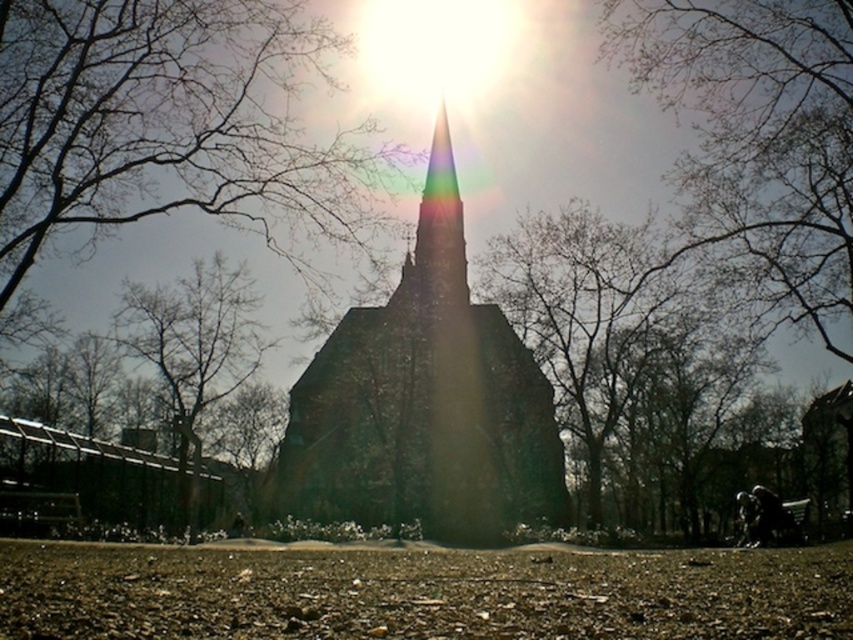
Is bare branches at center to the right of bare branches at upper center from the viewer's perspective?

No, bare branches at center is not to the right of bare branches at upper center.

Is bare branches at center thinner than bare branches at upper center?

No, bare branches at center is not thinner than bare branches at upper center.

Is point (166, 42) in front of point (834, 45)?

No, (166, 42) is further to viewer.

This screenshot has width=853, height=640. I want to click on bare branches at center, so click(172, 125).

Between point (265, 180) and point (310, 476), which one is positioned in front?

Point (265, 180)

In the scene shown: Is bare branches at center shorter than dark stone church at center?

Yes, bare branches at center is shorter than dark stone church at center.

What do you see at coordinates (172, 125) in the screenshot?
I see `bare branches at center` at bounding box center [172, 125].

The width and height of the screenshot is (853, 640). In order to click on bare branches at center in this screenshot , I will do `click(172, 125)`.

Between point (378, 385) and point (643, 348), which one is positioned behind?

The point (378, 385) is behind.

Looking at this image, is dark stone church at center positioned at the back of green leafy tree at center?

Yes.

Locate an element on the screen. The image size is (853, 640). dark stone church at center is located at coordinates (425, 401).